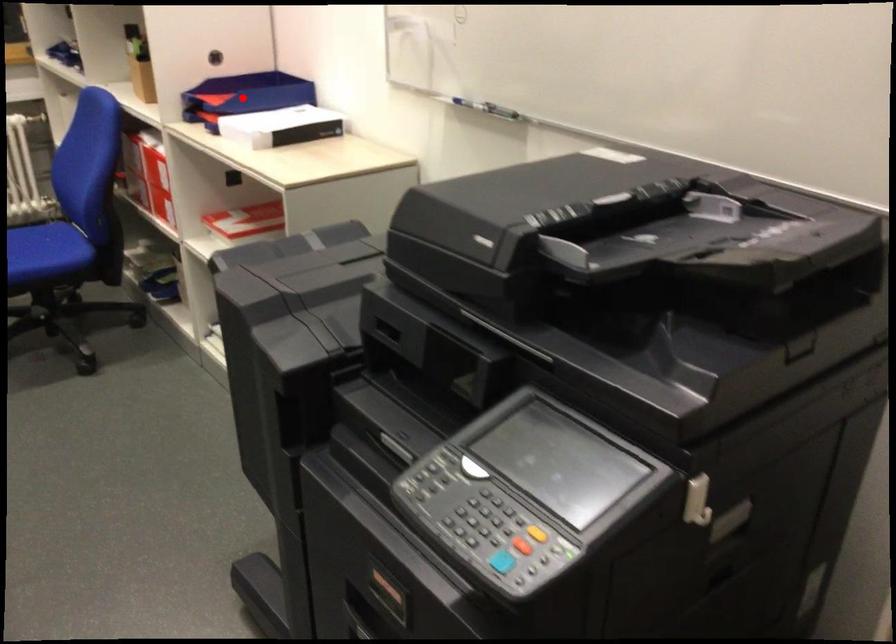
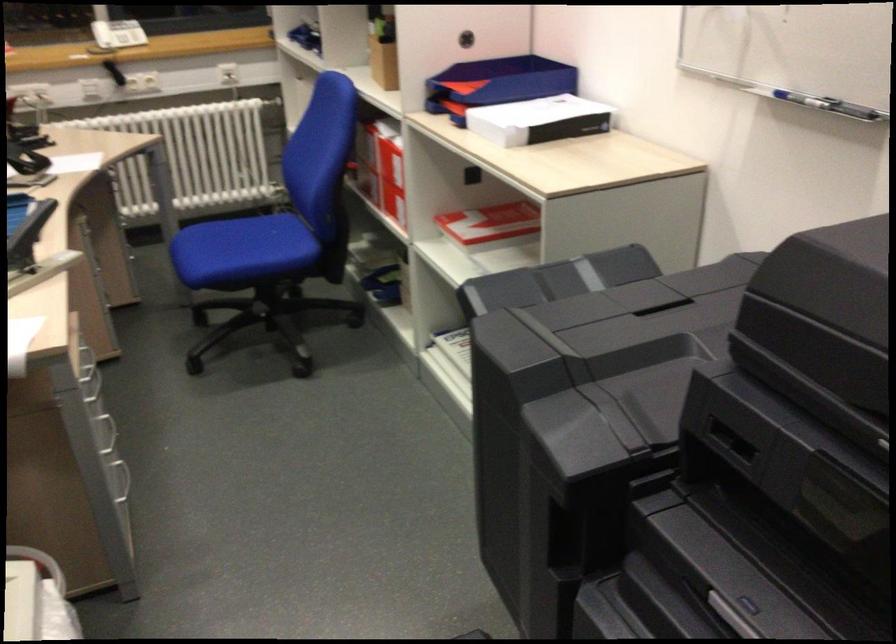
Where in the second image is the point corresponding to the highlighted location from the first image?

(495, 84)